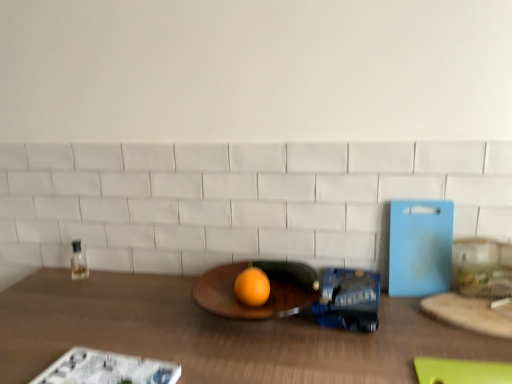
This screenshot has height=384, width=512. I want to click on unoccupied area in front of wooden cutting board at right, so click(473, 357).